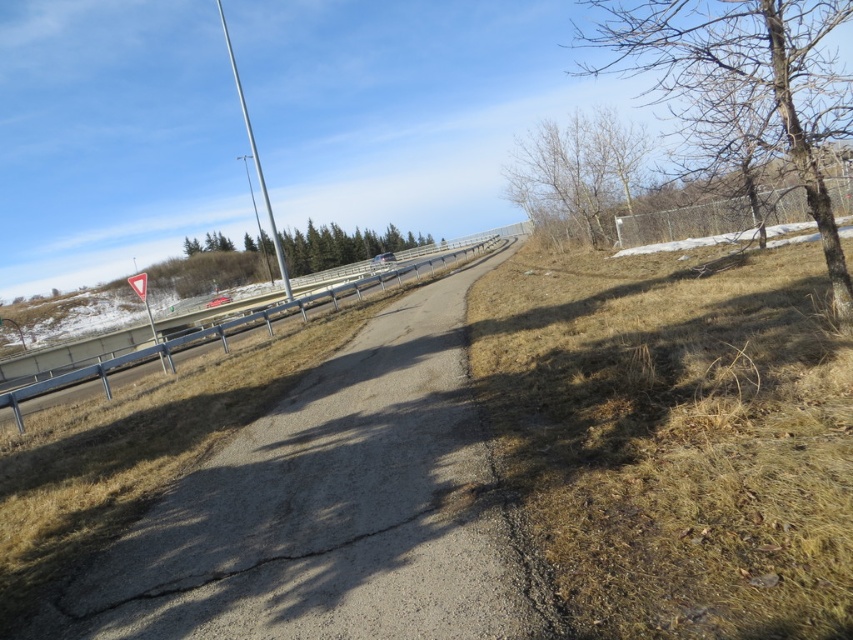
Question: Is gray asphalt highway at center below green leafy trees at upper center?

Choices:
 (A) no
 (B) yes

Answer: (B)

Question: Is the position of bare wood tree at upper right more distant than that of green leafy trees at upper center?

Choices:
 (A) yes
 (B) no

Answer: (B)

Question: Considering the real-world distances, which object is farthest from the gray asphalt highway at center?

Choices:
 (A) bare branches at upper right
 (B) bare wood tree at upper right
 (C) green leafy trees at upper center
 (D) metallic gray train track at left

Answer: (C)

Question: Can you confirm if bare wood tree at upper right is positioned above metallic gray train track at left?

Choices:
 (A) yes
 (B) no

Answer: (A)

Question: Which object is farther from the camera taking this photo?

Choices:
 (A) metallic gray train track at left
 (B) bare wood tree at upper right

Answer: (A)

Question: Among these objects, which one is nearest to the camera?

Choices:
 (A) bare wood tree at upper right
 (B) bare branches at upper right
 (C) gray asphalt highway at center

Answer: (C)